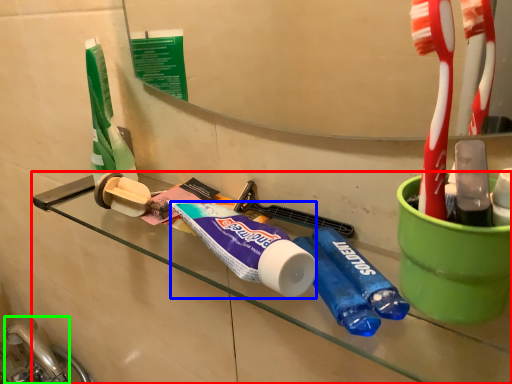
Question: Considering the real-world distances, which object is farthest from counter (highlighted by a red box)? toothpaste (highlighted by a blue box) or faucet (highlighted by a green box)?

Choices:
 (A) toothpaste
 (B) faucet

Answer: (B)